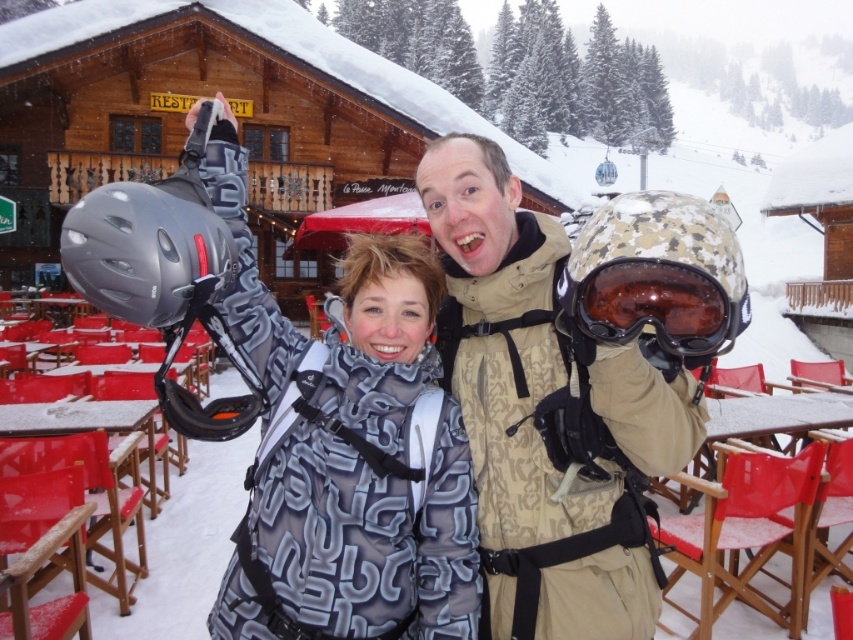
Question: Is matte black helmet at upper center below camouflage fabric helmet at center?

Choices:
 (A) no
 (B) yes

Answer: (B)

Question: Which object appears farthest from the camera in this image?

Choices:
 (A) matte black goggles at center
 (B) camouflage fabric helmet at center
 (C) matte black helmet at upper center

Answer: (B)

Question: Which object is closer to the camera taking this photo?

Choices:
 (A) matte black helmet at upper center
 (B) camouflage fabric helmet at center
 (C) matte black goggles at center

Answer: (C)

Question: Is matte black helmet at upper center above matte black goggles at center?

Choices:
 (A) no
 (B) yes

Answer: (A)

Question: Estimate the real-world distances between objects in this image. Which object is closer to the camouflage fabric helmet at center?

Choices:
 (A) matte black helmet at upper center
 (B) matte black goggles at center

Answer: (A)

Question: Does matte black helmet at upper center appear over camouflage fabric helmet at center?

Choices:
 (A) no
 (B) yes

Answer: (A)